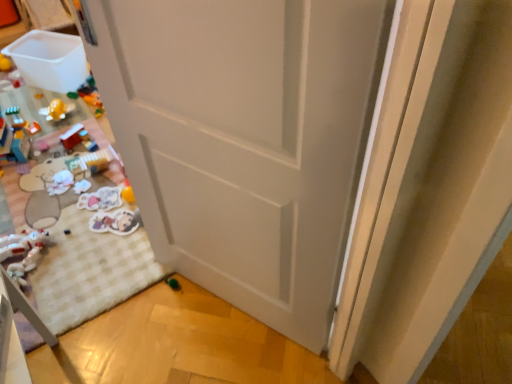
Question: Does matte plastic stickers at lower left, which ranks as the sixth toy in left-to-right order, come behind white plush toy at lower left, which ranks as the fifth toy in right-to-left order?

Choices:
 (A) yes
 (B) no

Answer: (B)

Question: Is white plush toy at lower left, which ranks as the fifth toy in right-to-left order, at the back of matte plastic stickers at lower left, marked as the third toy in a right-to-left arrangement?

Choices:
 (A) yes
 (B) no

Answer: (A)

Question: From a real-world perspective, is matte plastic stickers at lower left, marked as the third toy in a right-to-left arrangement, located beneath white plush toy at lower left, which ranks as the fifth toy in right-to-left order?

Choices:
 (A) no
 (B) yes

Answer: (A)

Question: Is matte plastic stickers at lower left, which ranks as the sixth toy in left-to-right order, closer to the viewer compared to white plush toy at lower left, which ranks as the fifth toy in right-to-left order?

Choices:
 (A) no
 (B) yes

Answer: (B)

Question: Considering the relative sizes of matte plastic stickers at lower left, marked as the third toy in a right-to-left arrangement, and white plush toy at lower left, positioned as the 4th toy in left-to-right order, in the image provided, is matte plastic stickers at lower left, marked as the third toy in a right-to-left arrangement, shorter than white plush toy at lower left, positioned as the 4th toy in left-to-right order,?

Choices:
 (A) no
 (B) yes

Answer: (A)

Question: From the image's perspective, is matte plastic stickers at lower left, which ranks as the sixth toy in left-to-right order, above white plush toy at lower left, which ranks as the fifth toy in right-to-left order?

Choices:
 (A) no
 (B) yes

Answer: (A)

Question: Is matte plastic stickers at lower left, which ranks as the seventh toy in left-to-right order, turned away from green rubber toy at lower center, the eighth toy in the left-to-right sequence?

Choices:
 (A) no
 (B) yes

Answer: (A)

Question: Is matte plastic stickers at lower left, positioned as the 2th toy in right-to-left order, positioned before green rubber toy at lower center, the eighth toy in the left-to-right sequence?

Choices:
 (A) yes
 (B) no

Answer: (B)

Question: Is matte plastic stickers at lower left, positioned as the 2th toy in right-to-left order, bigger than green rubber toy at lower center, the eighth toy in the left-to-right sequence?

Choices:
 (A) yes
 (B) no

Answer: (A)

Question: From a real-world perspective, is matte plastic stickers at lower left, positioned as the 2th toy in right-to-left order, located beneath green rubber toy at lower center, the first toy from the right?

Choices:
 (A) yes
 (B) no

Answer: (B)

Question: Is matte plastic stickers at lower left, positioned as the 2th toy in right-to-left order, outside green rubber toy at lower center, the eighth toy in the left-to-right sequence?

Choices:
 (A) no
 (B) yes

Answer: (B)

Question: Considering the relative sizes of matte plastic stickers at lower left, which ranks as the seventh toy in left-to-right order, and green rubber toy at lower center, the first toy from the right, in the image provided, is matte plastic stickers at lower left, which ranks as the seventh toy in left-to-right order, shorter than green rubber toy at lower center, the first toy from the right,?

Choices:
 (A) yes
 (B) no

Answer: (A)

Question: From the image's perspective, is translucent plastic toy at left, which is the 1th toy in left-to-right order, on white plush toy at lower left, marked as the 7th toy in a right-to-left arrangement?

Choices:
 (A) no
 (B) yes

Answer: (B)